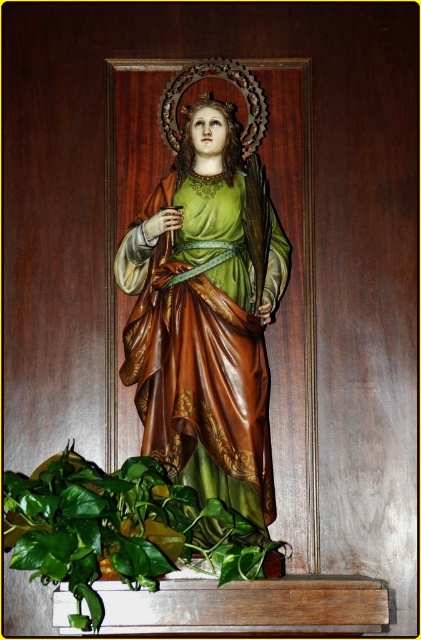
Question: Which point is farther from the camera taking this photo?

Choices:
 (A) (269, 470)
 (B) (132, 531)

Answer: (A)

Question: Is matte gold statue at center to the right of green leafy plant at lower left from the viewer's perspective?

Choices:
 (A) yes
 (B) no

Answer: (A)

Question: Does matte gold statue at center appear on the right side of green leafy plant at lower left?

Choices:
 (A) no
 (B) yes

Answer: (B)

Question: Among these objects, which one is farthest from the camera?

Choices:
 (A) green leafy plant at lower left
 (B) matte gold statue at center

Answer: (B)

Question: Is matte gold statue at center wider than green leafy plant at lower left?

Choices:
 (A) yes
 (B) no

Answer: (B)